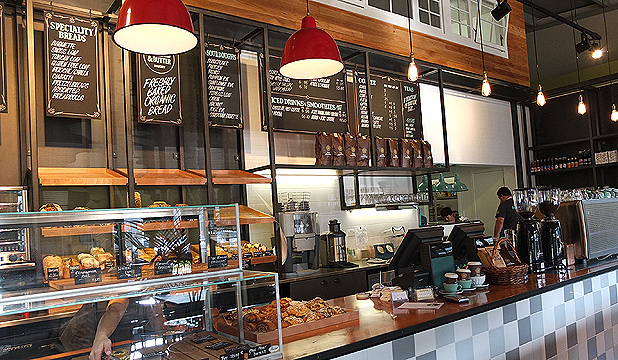
Where is `lights`? lights is located at coordinates (166, 27), (320, 45), (408, 77), (489, 85), (540, 102), (578, 109), (609, 113), (591, 48).